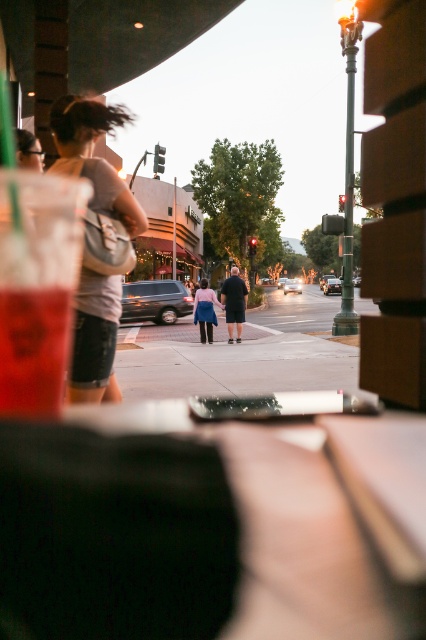
You are a GUI agent. You are given a task and a screenshot of the screen. Output one action in this format:
    pyautogui.click(x=<x>, y=<y>)
    Task: Click on the matte gray backpack at left
    The width and height of the screenshot is (426, 640).
    Given the screenshot: What is the action you would take?
    pyautogui.click(x=94, y=156)

In the scene shown: Does matte gray backpack at left appear under translucent glass beverage at lower left?

No, matte gray backpack at left is not below translucent glass beverage at lower left.

Is point (71, 102) positioned after point (62, 355)?

Yes, it is behind point (62, 355).

Identify the location of matte gray backpack at left. This screenshot has width=426, height=640. (94, 156).

Can you confirm if matte gray backpack at left is positioned to the left of pink fabric skirt at center?

Yes, matte gray backpack at left is to the left of pink fabric skirt at center.

Is matte gray backpack at left further to the viewer compared to pink fabric skirt at center?

That is False.

Who is more forward, (77,157) or (201,294)?

Positioned in front is point (77,157).

Locate an element on the screen. Image resolution: width=426 pixels, height=640 pixels. matte gray backpack at left is located at coordinates (94, 156).

Can you confirm if translucent glass beverage at lower left is thinner than pink fabric skirt at center?

Yes.

Who is positioned more to the left, translucent glass beverage at lower left or pink fabric skirt at center?

pink fabric skirt at center is more to the left.

Describe the element at coordinates (34, 349) in the screenshot. This screenshot has height=640, width=426. I see `translucent glass beverage at lower left` at that location.

Locate an element on the screen. Image resolution: width=426 pixels, height=640 pixels. translucent glass beverage at lower left is located at coordinates (34, 349).